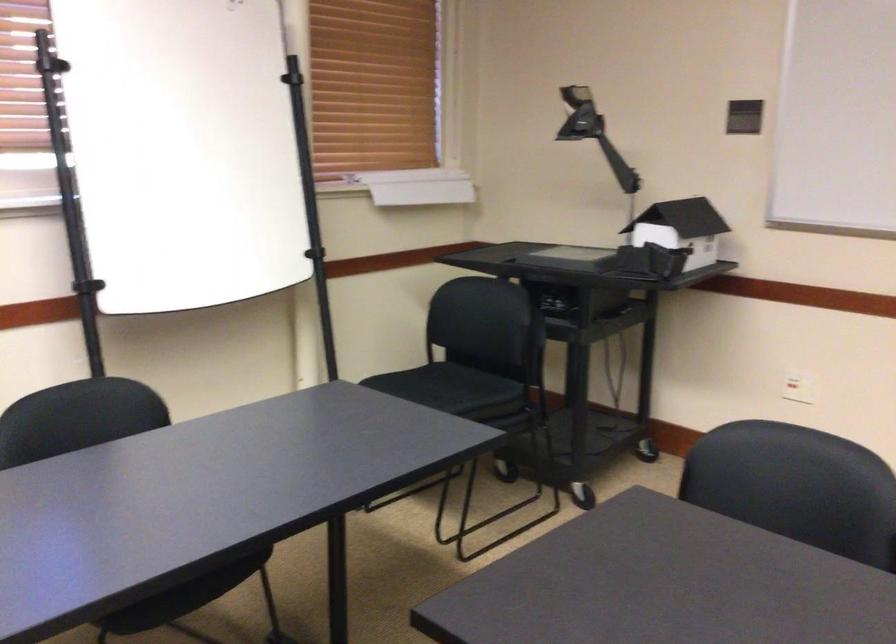
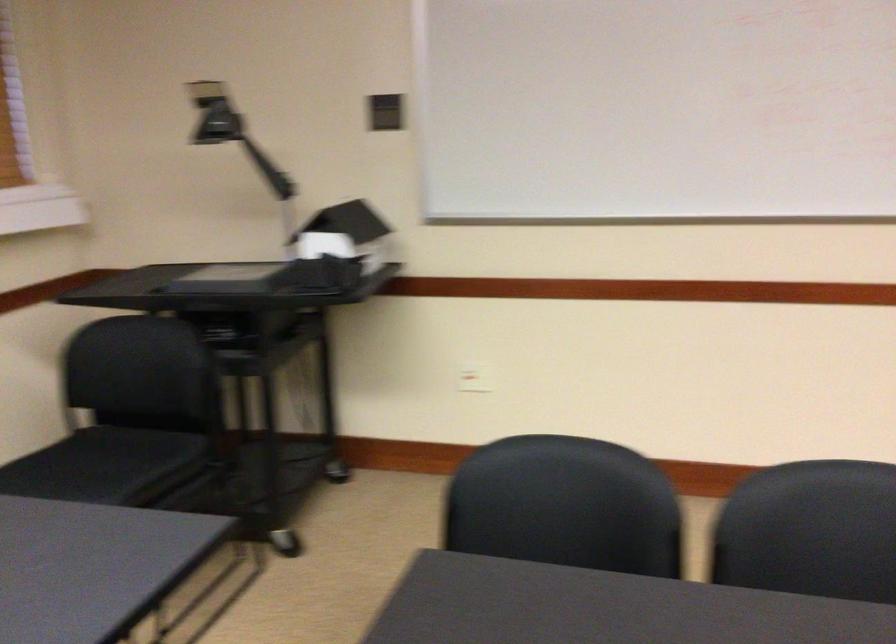
Where in the second image is the point corresponding to (791,382) from the first image?

(474, 377)